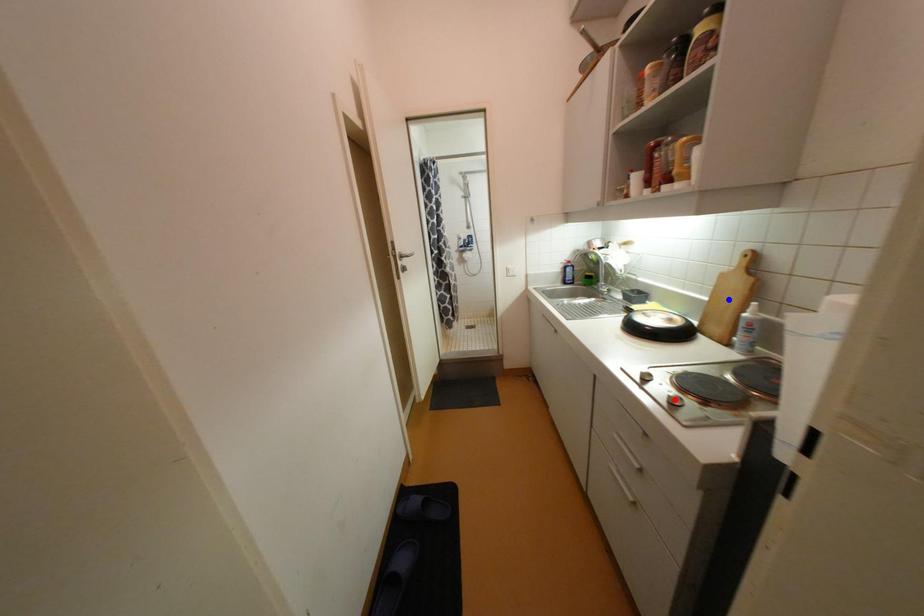
Question: In the image, two points are highlighted. Which point is nearer to the camera? Reply with the corresponding letter.

Choices:
 (A) blue point
 (B) red point

Answer: (B)